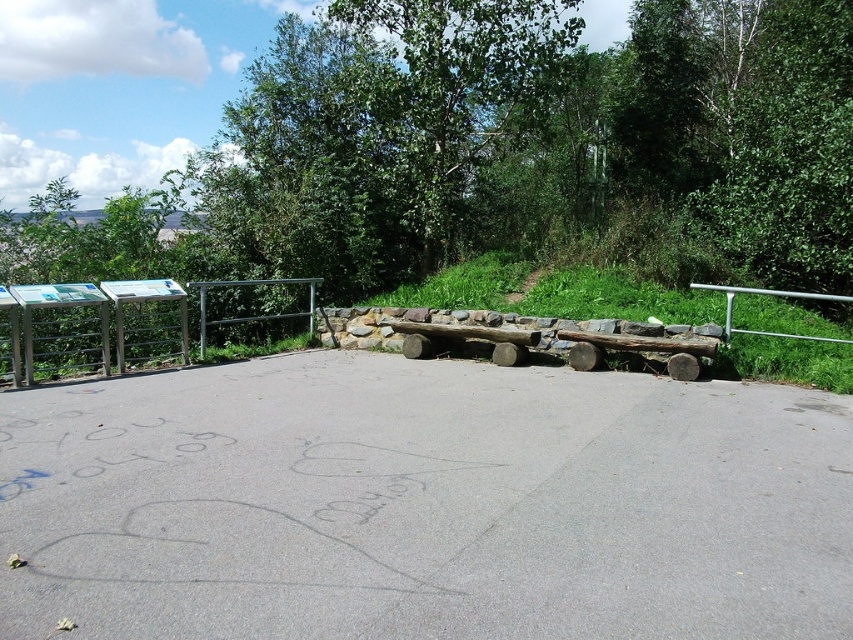
You are designing a new fence for a garden and want to ensure it matches the existing structures. Based on the image, which of the two silver metallic structures, the silver metallic fence at left or the silver metallic rail at right, is narrower in width?

The silver metallic fence at left is narrower in width than the silver metallic rail at right.

You are standing on the paved area and want to walk towards the grassy slope. Which object, the silver metallic fence at left or the silver metallic rail at right, is closer to your path?

The silver metallic fence at left is closer to your path because it is positioned below the silver metallic rail at right, meaning it is lower and nearer to the paved area where you are standing.